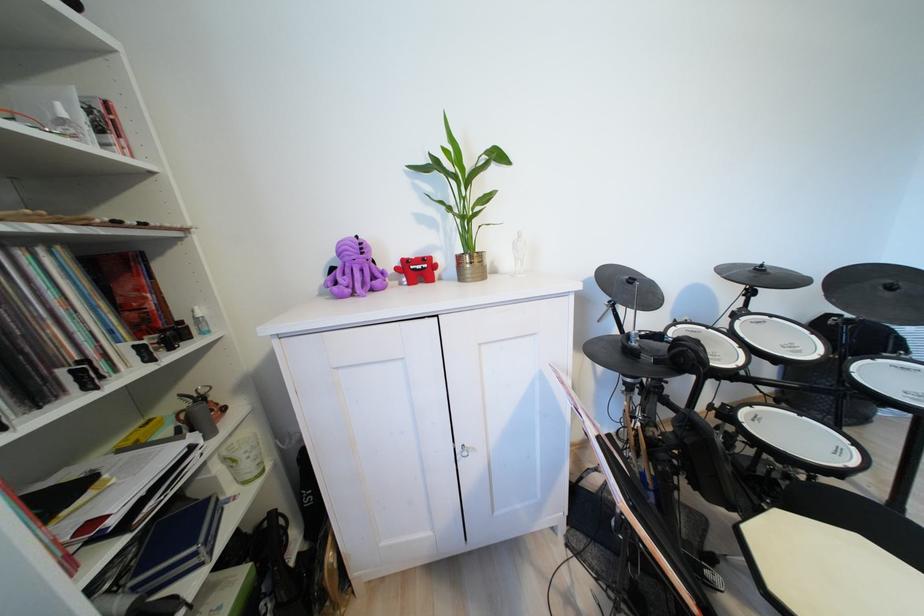
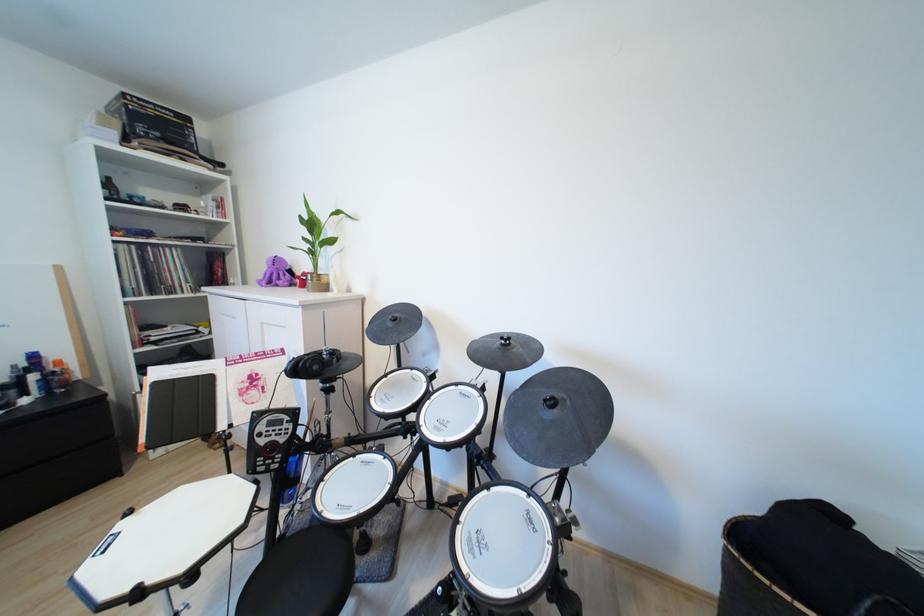
Find the pixel in the second image that matches the point at 411,262 in the first image.

(310, 275)